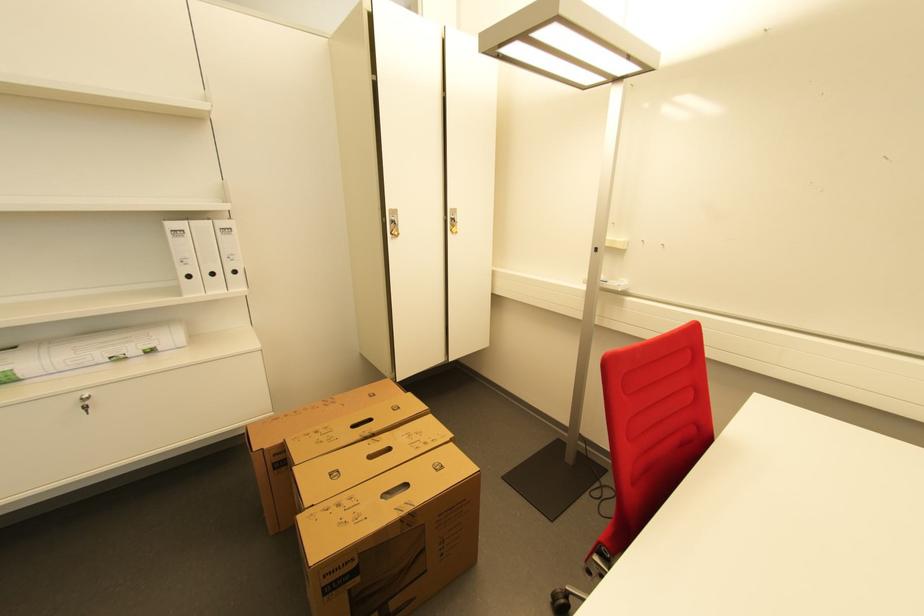
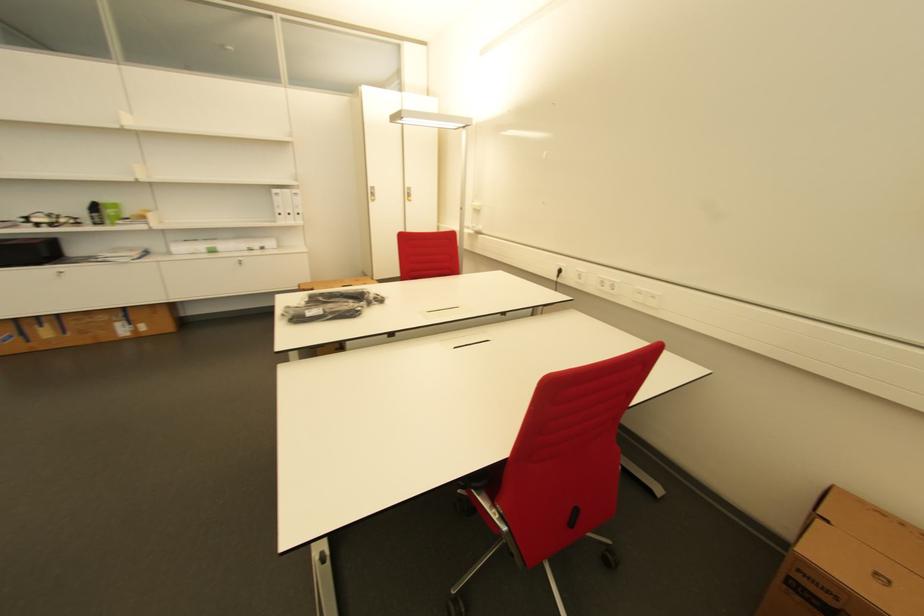
Locate, in the second image, the point that corresponds to [217,275] in the first image.

(294, 216)